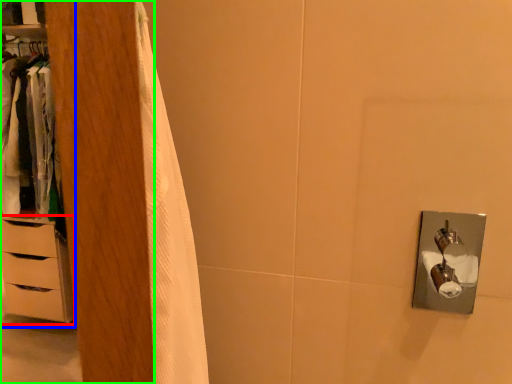
Question: Estimate the real-world distances between objects in this image. Which object is farther from chest of drawers (highlighted by a red box), dresser (highlighted by a blue box) or armoire (highlighted by a green box)?

Choices:
 (A) dresser
 (B) armoire

Answer: (B)